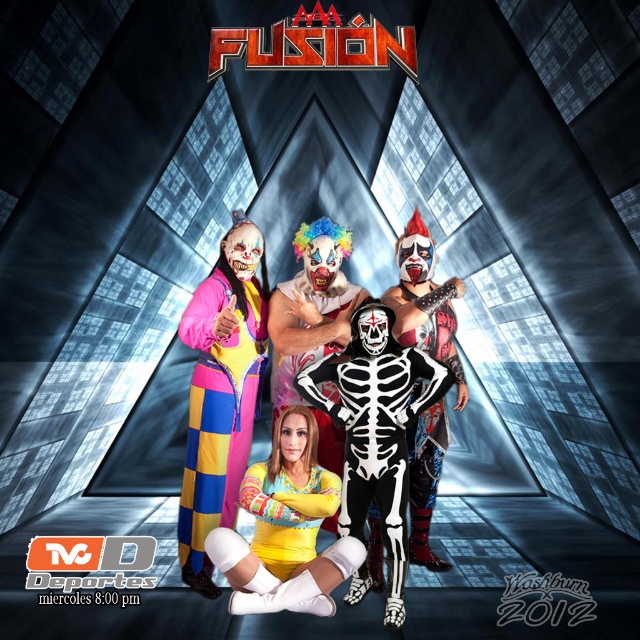
You are a photographer at this event. You need to capture a photo where the matte black skeleton suit at center and the multicolored fabric clown suit at center are both clearly visible. Since the lighting is very bright, which costume might be harder to see in the photo and why?

The matte black skeleton suit at center might be harder to see in the photo because it is positioned on the right side of the multicolored fabric clown suit at center, and the bright lighting could cause it to blend into the shadows or become overexposed.

You are a photographer setting up for a photo shoot in this futuristic tunnel. You need to ensure that both the matte black skeleton suit at center and the multicolored fabric clown suit at center are clearly visible in the frame. Considering their sizes, which costume will require more space in the foreground to avoid being cut off?

The matte black skeleton suit at center is much taller than the multicolored fabric clown suit at center, so it will require more space in the foreground to avoid being cut off.

You are a photographer positioned at the entrance of the tunnel. You need to capture a photo of the matte black skeleton suit at center. According to the coordinates provided, where should you aim your camera to ensure the suit is in the center of your frame?

The matte black skeleton suit at center is located at coordinates point (332, 472), so you should aim your camera at that point to center the suit in your frame.